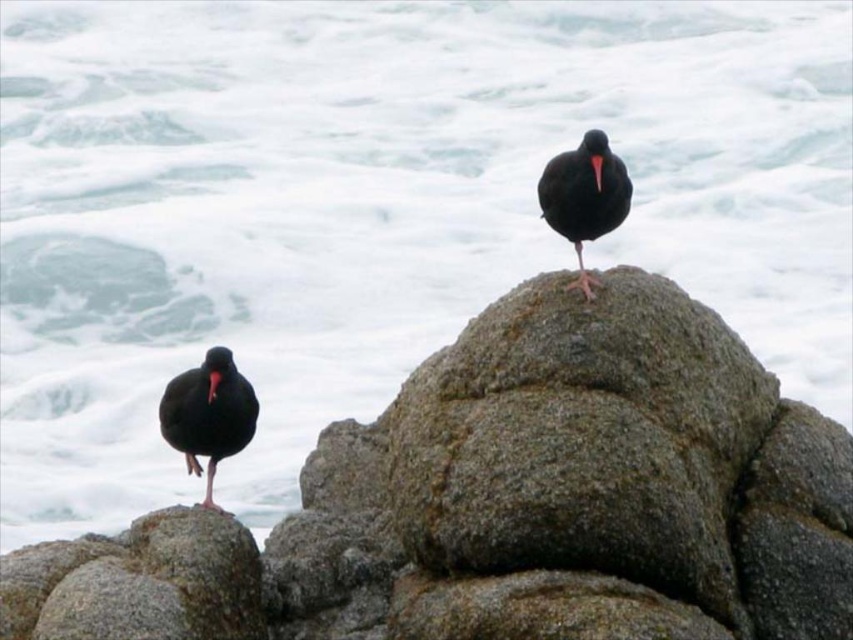
Question: Among these objects, which one is farthest from the camera?

Choices:
 (A) black matte beak at upper center
 (B) black glossy beak at lower left
 (C) gray rough rock at lower left

Answer: (A)

Question: Is matte black bird at left below black matte beak at upper center?

Choices:
 (A) yes
 (B) no

Answer: (A)

Question: Is the position of shiny black bird at center more distant than that of black glossy beak at lower left?

Choices:
 (A) yes
 (B) no

Answer: (A)

Question: Can you confirm if gray rough rock at lower left is bigger than shiny black bird at center?

Choices:
 (A) yes
 (B) no

Answer: (A)

Question: Which is farther from the gray rough rock at lower left?

Choices:
 (A) black matte beak at upper center
 (B) shiny black bird at center
 (C) matte black bird at left
 (D) black glossy beak at lower left

Answer: (A)

Question: Which point is closer to the camera?

Choices:
 (A) (590, 157)
 (B) (225, 353)

Answer: (B)